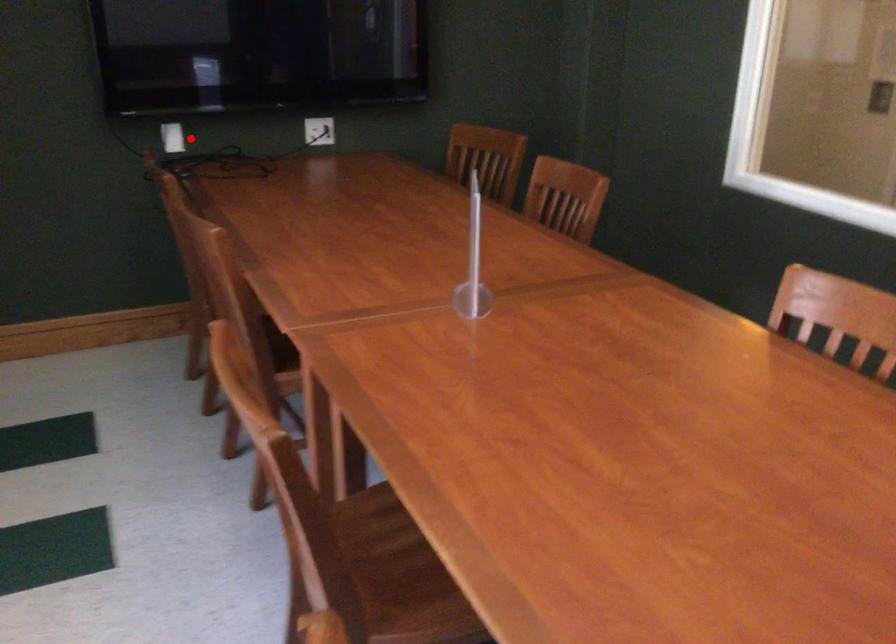
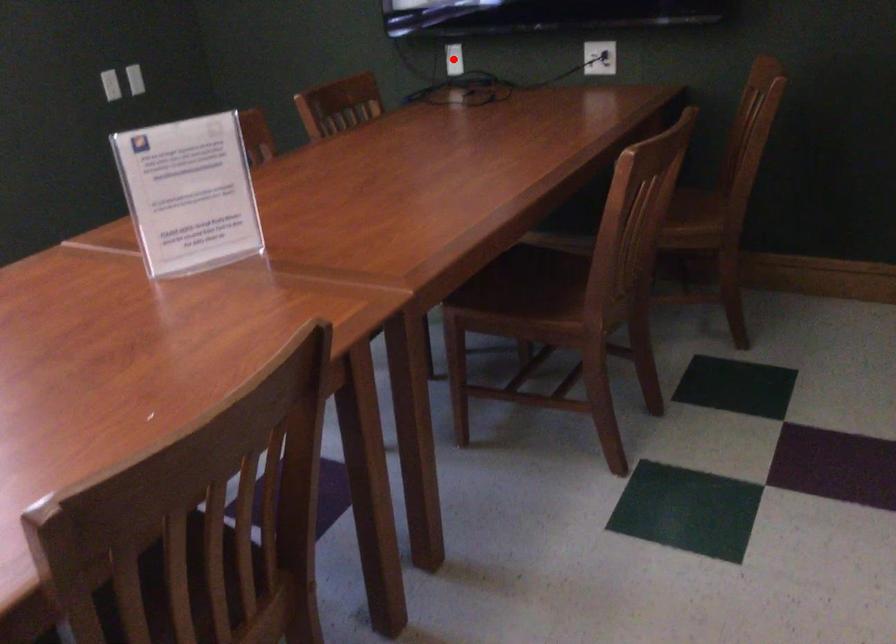
I am providing you with two images of the same scene from different viewpoints. A red point is marked on the first image and another point is marked on the second image. Do the highlighted points in image1 and image2 indicate the same real-world spot?

Yes